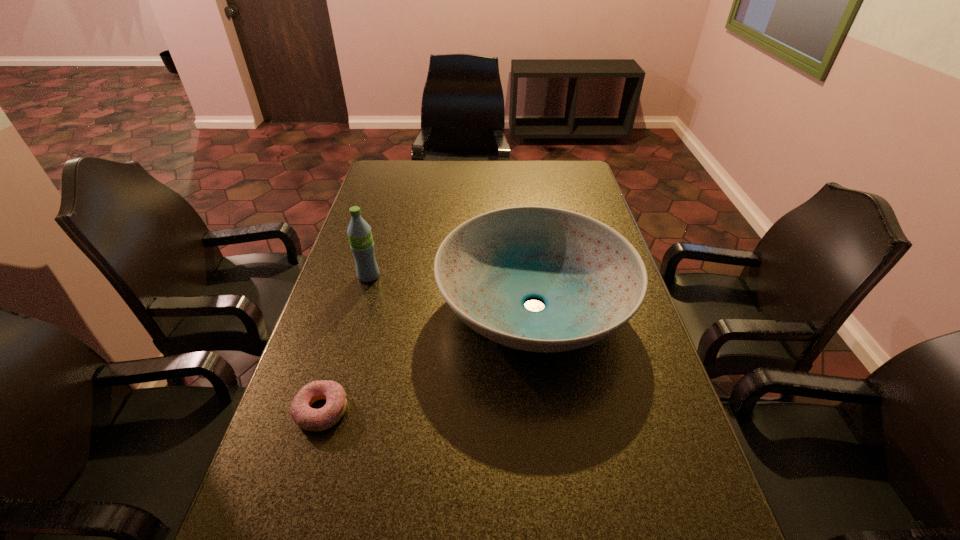
In order to click on object present at the right edge in this screenshot , I will do `click(592, 280)`.

Image resolution: width=960 pixels, height=540 pixels. I want to click on free space at the far edge of the desktop, so click(x=545, y=180).

This screenshot has width=960, height=540. I want to click on vacant space at the left edge, so click(399, 200).

This screenshot has height=540, width=960. What are the coordinates of `free space at the right edge of the desktop` in the screenshot? It's located at click(x=649, y=382).

I want to click on free space at the far left corner of the desktop, so click(408, 183).

Where is `free point between the dish and the shortest object`? The width and height of the screenshot is (960, 540). free point between the dish and the shortest object is located at coordinates (428, 358).

Where is `free space between the water bottle and the doughnut`? free space between the water bottle and the doughnut is located at coordinates (345, 343).

You are a GUI agent. You are given a task and a screenshot of the screen. Output one action in this format:
    pyautogui.click(x=<x>, y=<y>)
    Task: Click on the empty space that is in between the nearest object and the tallest object
    Image resolution: width=960 pixels, height=540 pixels.
    Given the screenshot: What is the action you would take?
    pyautogui.click(x=345, y=343)

The image size is (960, 540). In order to click on object that is the second closest to the second tallest object in this screenshot , I will do `click(359, 232)`.

The image size is (960, 540). Find the location of `object that ranks as the second closest to the water bottle`. object that ranks as the second closest to the water bottle is located at coordinates (310, 419).